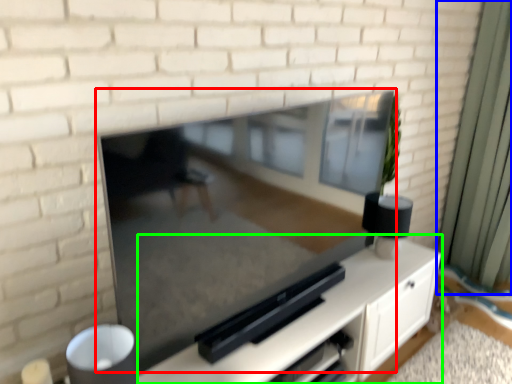
Question: Estimate the real-world distances between objects in this image. Which object is closer to fireplace (highlighted by a red box), curtain (highlighted by a blue box) or entertainment center (highlighted by a green box)?

Choices:
 (A) curtain
 (B) entertainment center

Answer: (B)